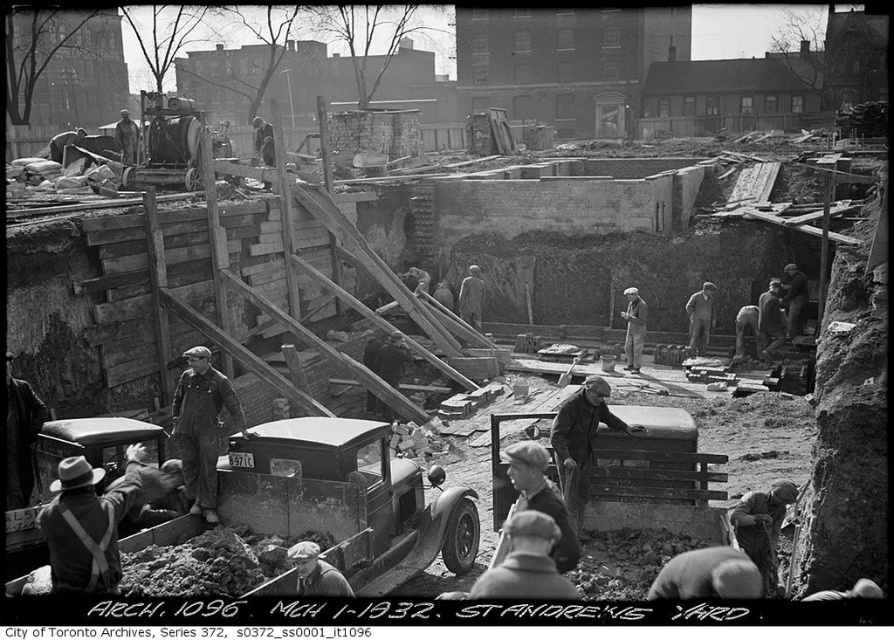
What do you see at coordinates (762, 525) in the screenshot? I see `rusty metal shovel at lower right` at bounding box center [762, 525].

Between point (736, 516) and point (696, 307), which one is positioned in front?

Positioned in front is point (736, 516).

In order to click on rusty metal shovel at lower right in this screenshot , I will do `click(762, 525)`.

Can you confirm if rusty metal shovel at lower right is shorter than light brown wooden plank at center?

Yes.

Who is shorter, rusty metal shovel at lower right or light brown wooden plank at center?

Standing shorter between the two is rusty metal shovel at lower right.

Does point (779, 500) come behind point (477, 276)?

No, (779, 500) is in front of (477, 276).

Where is `rusty metal shovel at lower right`? The image size is (894, 640). rusty metal shovel at lower right is located at coordinates (762, 525).

Can you confirm if smooth gray suit at center is smaller than light brown wooden plank at center?

Incorrect, smooth gray suit at center is not smaller in size than light brown wooden plank at center.

Between point (703, 324) and point (474, 291), which one is positioned in front?

Point (703, 324)

Who is more forward, (693, 337) or (467, 268)?

Positioned in front is point (693, 337).

The height and width of the screenshot is (640, 894). I want to click on smooth gray suit at center, so click(x=699, y=317).